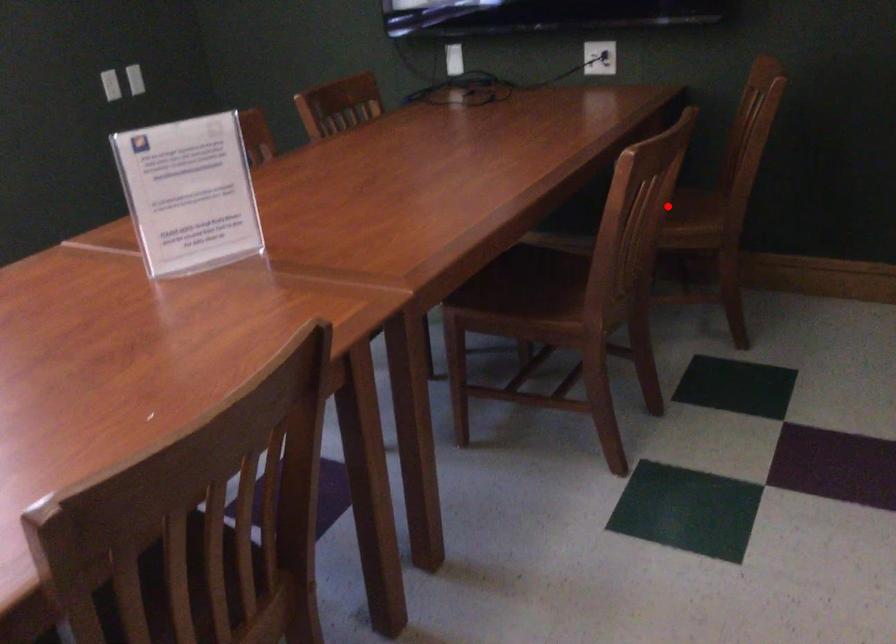
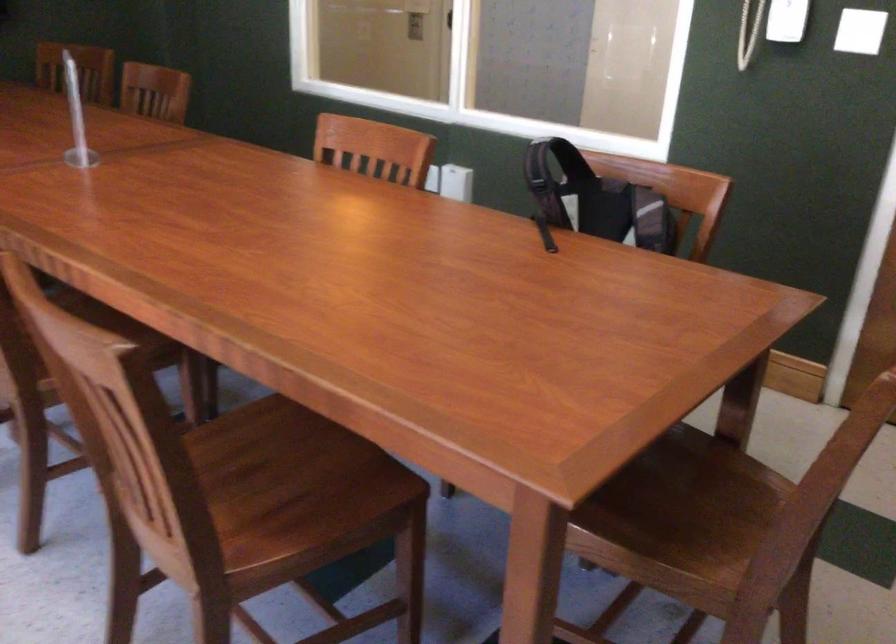
Question: I am providing you with two images of the same scene from different viewpoints. A red point is marked on the first image. At the location where the point appears in image 1, is it still visible in image 2?

Choices:
 (A) Yes
 (B) No

Answer: (B)